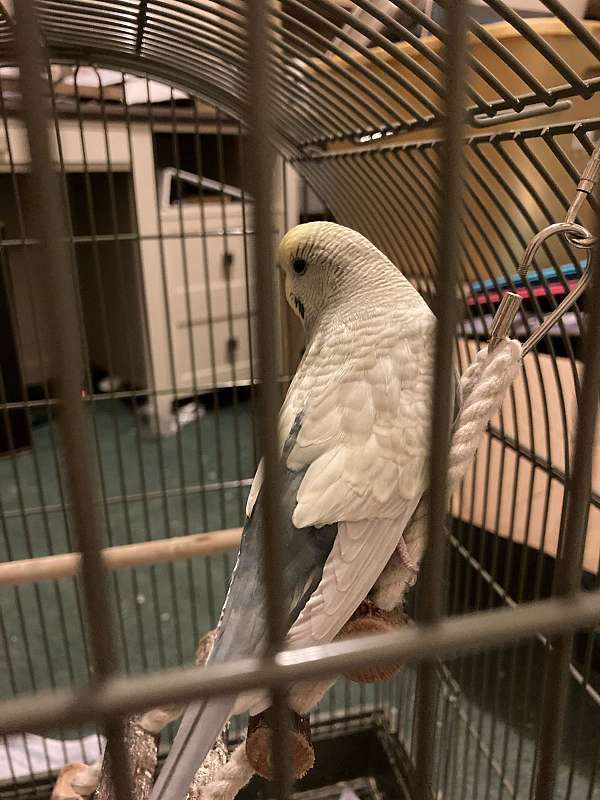
Where is `bottom drawer`? This screenshot has width=600, height=800. bottom drawer is located at coordinates (203, 348).